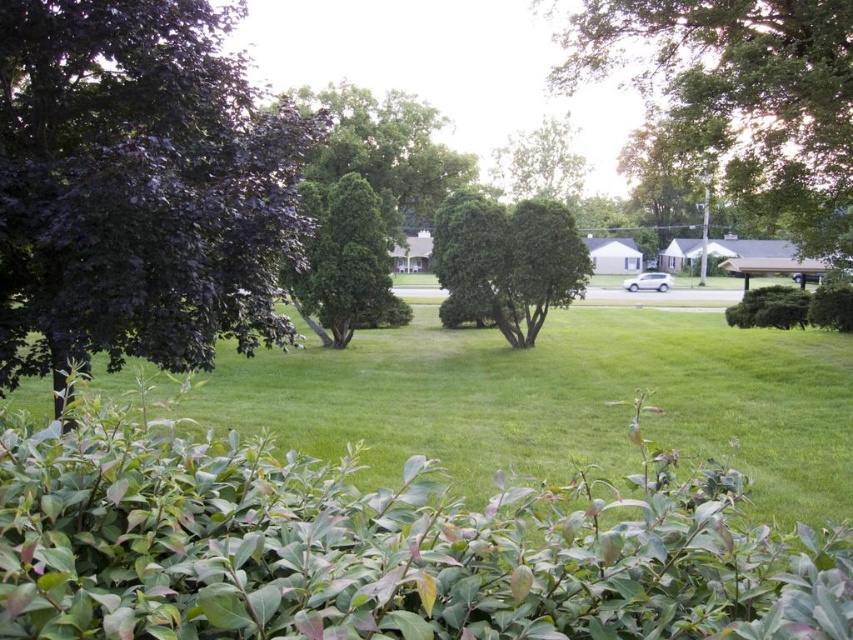
You are planning to plant a new tree in your garden. You have a space that can accommodate a tree up to the width of the green grass at center. Can the dark purple leafy tree at left fit in that space?

The dark purple leafy tree at left has a lesser width compared to the green grass at center, so it will fit in the space.